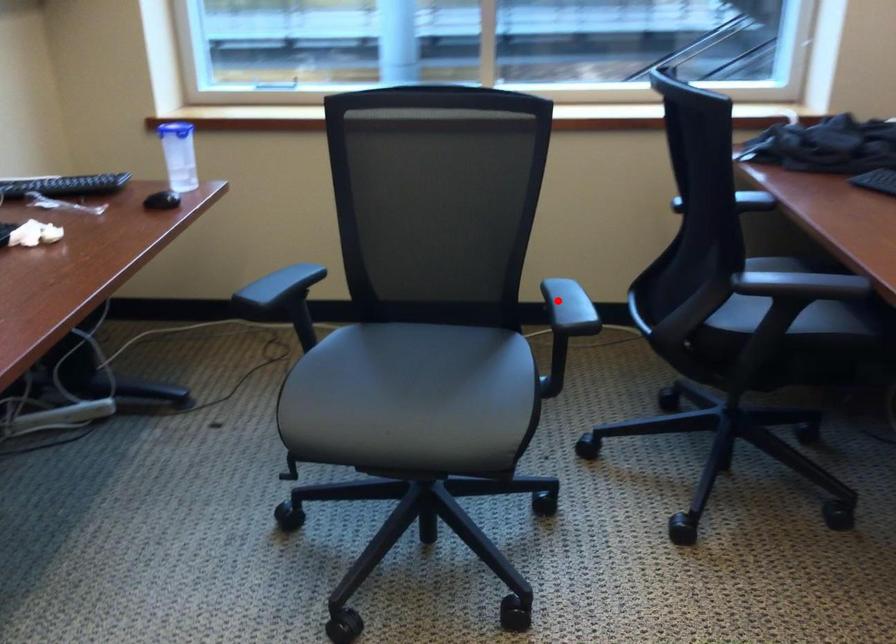
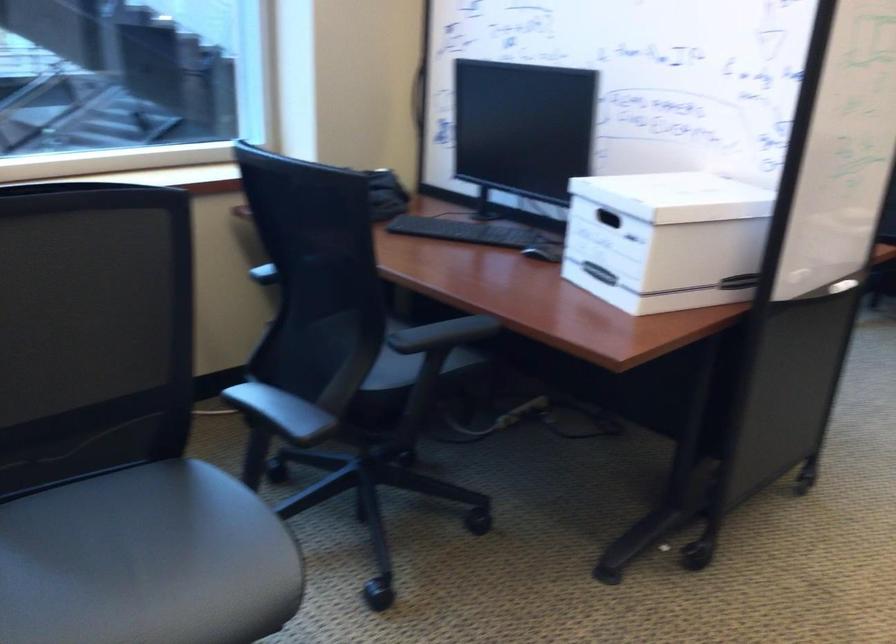
Question: A red point is marked in image1. In image2, is the corresponding 3D point closer to the camera or farther? Reply with the corresponding letter.

Choices:
 (A) The corresponding 3D point is closer.
 (B) The corresponding 3D point is farther.

Answer: (A)